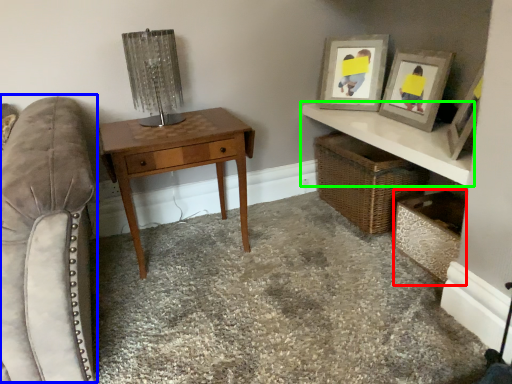
Question: Which object is positioned closest to shelf (highlighted by a red box)? Select from swivel chair (highlighted by a blue box) and shelf (highlighted by a green box).

Choices:
 (A) swivel chair
 (B) shelf

Answer: (B)